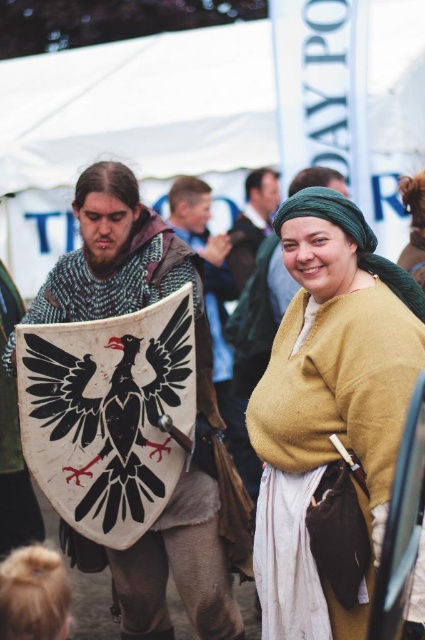
Looking at this image, you are standing at the point marked by coordinates point (238, 378). You want to throw a ball to a friend who is exactly 20 meters away from you. Can you reach your friend by throwing the ball from your current position?

The distance between point (238, 378) and the viewer is 19.69 meters, so yes, you can reach your friend since the distance is slightly less than 20 meters.

You are organizing a costume party and need to ensure that all items fit into a storage box. The matte yellow sweater at center and the white leather shield at center must be packed. Given that the box can only accommodate items up to the size of the shield, will both items fit?

The matte yellow sweater at center has a larger size compared to the white leather shield at center. Since the box can only accommodate items up to the size of the shield, the sweater will not fit, so only the shield can be packed.

From the picture: You are a costume designer observing the historical reenactment scene. You notice the matte yellow sweater at center and the white leather shield at center. Which item is covering the other?

The matte yellow sweater at center is positioned over the white leather shield at center, so the sweater is covering the shield.